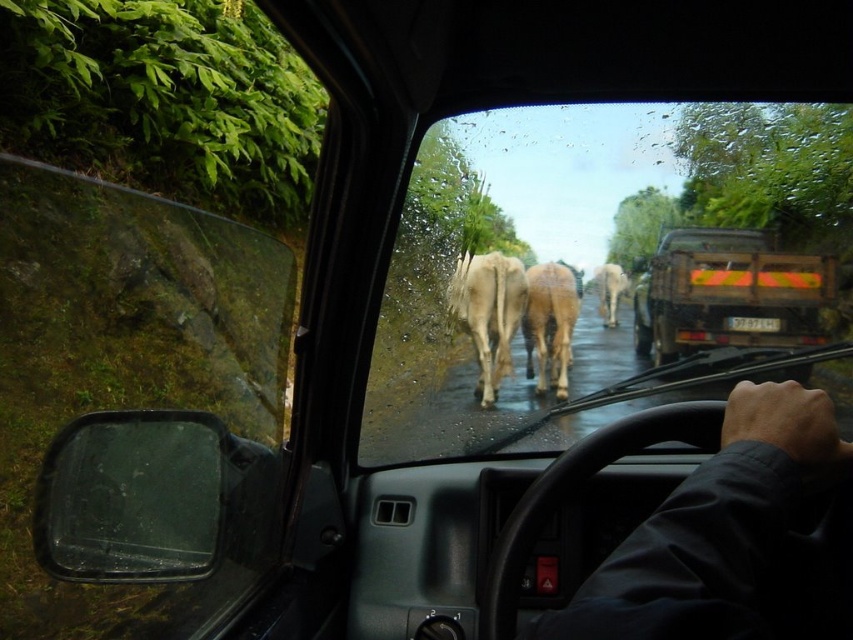
You are the driver of the vehicle. You notice your hand on the steering wheel and the cows ahead. Which object is closer to you, the dark fabric hand at center or the white matte cow at center?

The dark fabric hand at center is closer to you because it appears taller than the white matte cow at center in the scene.

You are driving a car and see two points on the road ahead. The first point is at coordinates point [555,433] and the second is at point [694,314]. Which point is closer to your current position?

Point [555,433] is in front of point [694,314], so the first point is closer to your current position.

You are driving a car and see the transparent glass windshield at center and the wooden planks truck at center ahead. Which object is closer to you?

The transparent glass windshield at center is closer to the viewer than the wooden planks truck at center.